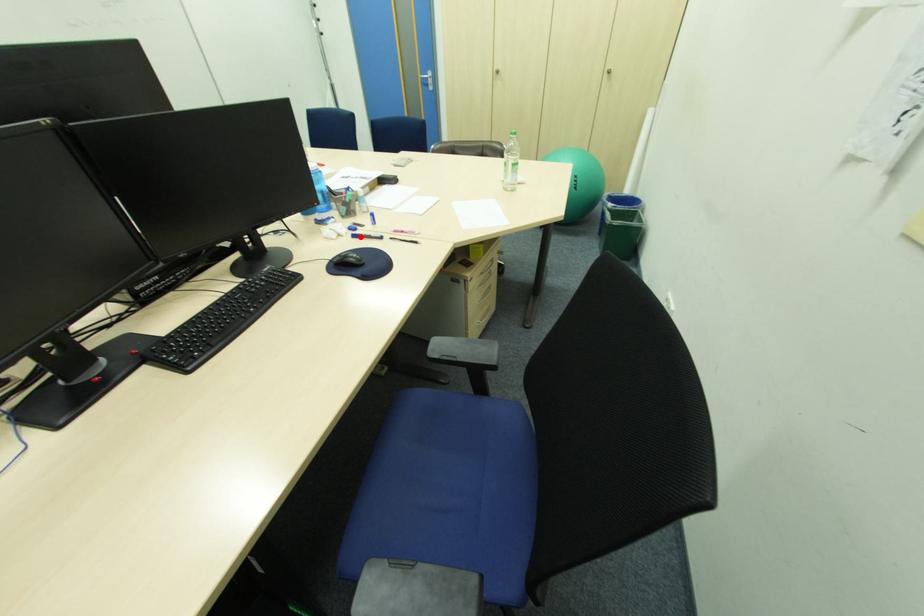
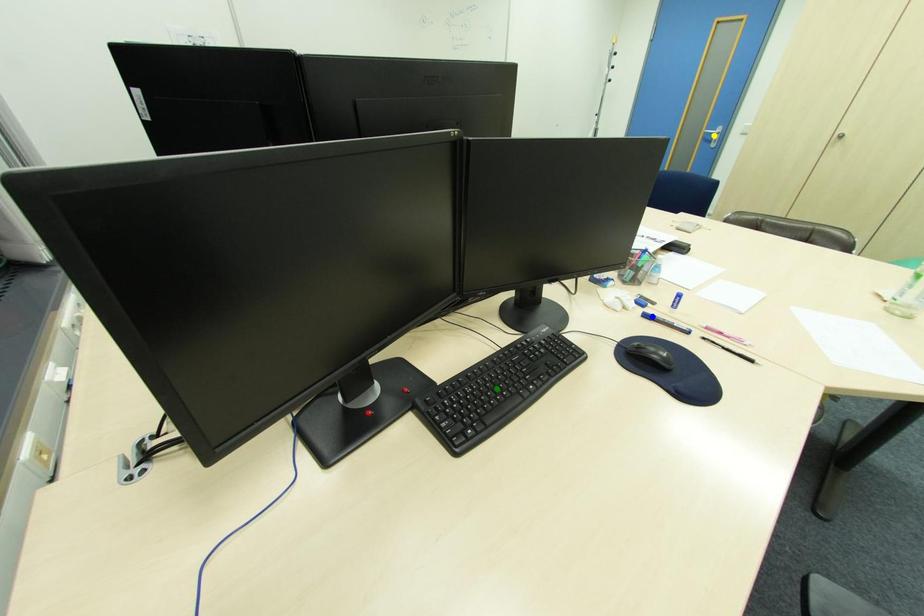
Question: I am providing you with two images of the same scene from different viewpoints. A red point is marked on the first image. You are given multiple points on the second image. In image 2, which mark is for the same physical point as the one in image 1?

Choices:
 (A) green point
 (B) blue point
 (C) yellow point

Answer: (B)